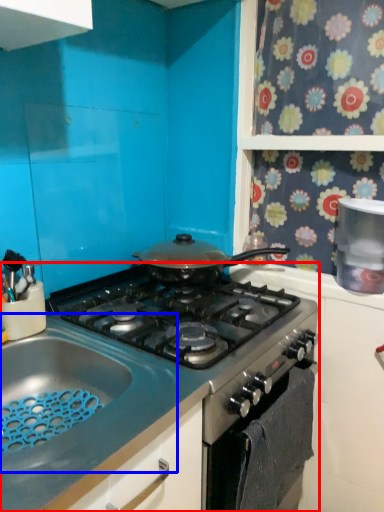
Question: Which point is further to the camera, gas stove (highlighted by a red box) or sink (highlighted by a blue box)?

Choices:
 (A) gas stove
 (B) sink

Answer: (A)